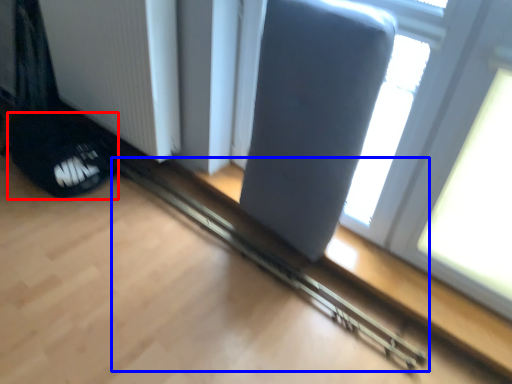
Question: Among these objects, which one is farthest to the camera, footwear (highlighted by a red box) or rail (highlighted by a blue box)?

Choices:
 (A) footwear
 (B) rail

Answer: (A)